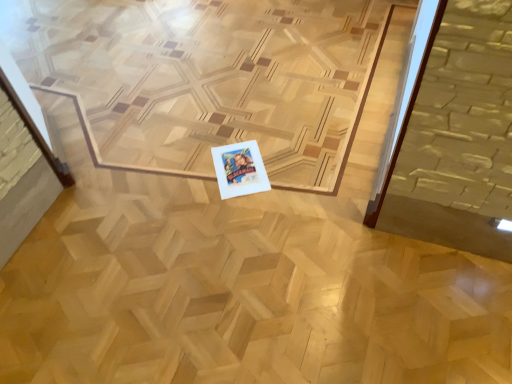
Question: Does white paper at center have a larger size compared to natural wood plywood at center?

Choices:
 (A) yes
 (B) no

Answer: (B)

Question: Would you say white paper at center is outside natural wood plywood at center?

Choices:
 (A) yes
 (B) no

Answer: (B)

Question: Does white paper at center appear on the left side of natural wood plywood at center?

Choices:
 (A) no
 (B) yes

Answer: (A)

Question: Is there a large distance between white paper at center and natural wood plywood at center?

Choices:
 (A) no
 (B) yes

Answer: (A)

Question: Is white paper at center taller than natural wood plywood at center?

Choices:
 (A) yes
 (B) no

Answer: (B)

Question: Is white paper at center positioned before natural wood plywood at center?

Choices:
 (A) no
 (B) yes

Answer: (A)

Question: Can you confirm if natural wood plywood at center is bigger than white paper at center?

Choices:
 (A) no
 (B) yes

Answer: (B)

Question: From the image's perspective, is natural wood plywood at center beneath white paper at center?

Choices:
 (A) no
 (B) yes

Answer: (A)

Question: Considering the relative positions of natural wood plywood at center and white paper at center in the image provided, is natural wood plywood at center to the right of white paper at center from the viewer's perspective?

Choices:
 (A) yes
 (B) no

Answer: (B)

Question: Considering the relative sizes of natural wood plywood at center and white paper at center in the image provided, is natural wood plywood at center thinner than white paper at center?

Choices:
 (A) no
 (B) yes

Answer: (A)

Question: Does natural wood plywood at center lie behind white paper at center?

Choices:
 (A) yes
 (B) no

Answer: (B)

Question: Are natural wood plywood at center and white paper at center making contact?

Choices:
 (A) no
 (B) yes

Answer: (A)

Question: Is natural wood plywood at center wider or thinner than white paper at center?

Choices:
 (A) wide
 (B) thin

Answer: (A)